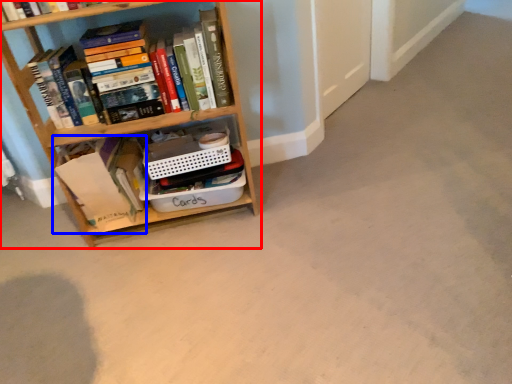
Question: Which object appears closest to the camera in this image, bookcase (highlighted by a red box) or book (highlighted by a blue box)?

Choices:
 (A) bookcase
 (B) book

Answer: (A)